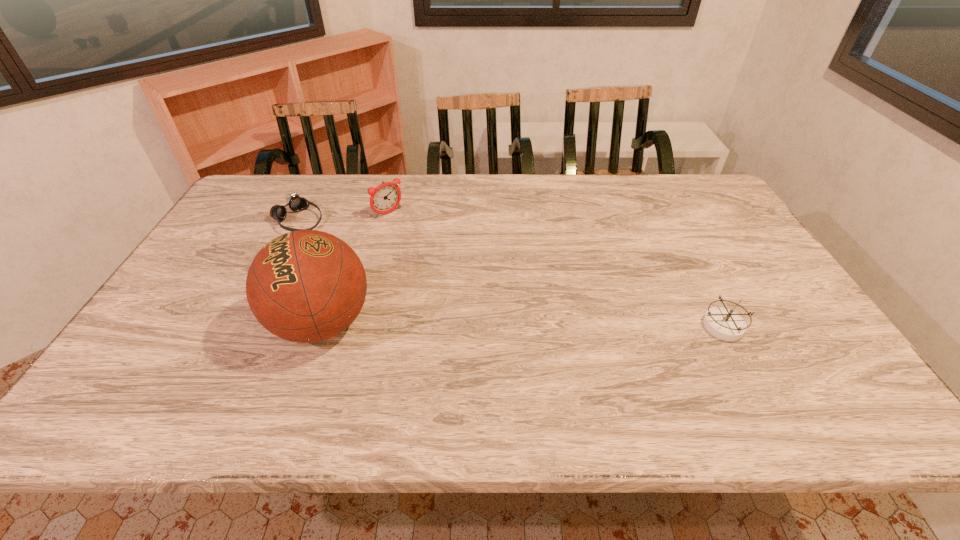
You are a GUI agent. You are given a task and a screenshot of the screen. Output one action in this format:
    pyautogui.click(x=<x>, y=<y>)
    Task: Click on the free location at the right edge
    
    Given the screenshot: What is the action you would take?
    pyautogui.click(x=699, y=246)

Image resolution: width=960 pixels, height=540 pixels. In order to click on vacant space at the far left corner of the desktop in this screenshot , I will do `click(254, 181)`.

Locate an element on the screen. The height and width of the screenshot is (540, 960). unoccupied area between the rightmost object and the alarm clock is located at coordinates (556, 269).

You are a GUI agent. You are given a task and a screenshot of the screen. Output one action in this format:
    pyautogui.click(x=<x>, y=<y>)
    Task: Click on the free space between the alarm clock and the goggles
    The image size is (960, 540).
    Given the screenshot: What is the action you would take?
    pyautogui.click(x=344, y=217)

Where is `free space between the goggles and the compass`? The height and width of the screenshot is (540, 960). free space between the goggles and the compass is located at coordinates (511, 273).

Locate an element on the screen. Image resolution: width=960 pixels, height=540 pixels. unoccupied area between the basketball and the rightmost object is located at coordinates (522, 325).

Where is `blank region between the goggles and the second tallest object`? This screenshot has width=960, height=540. blank region between the goggles and the second tallest object is located at coordinates (344, 217).

This screenshot has height=540, width=960. Find the location of `free point between the goggles and the third shortest object`. free point between the goggles and the third shortest object is located at coordinates (344, 217).

Locate an element on the screen. Image resolution: width=960 pixels, height=540 pixels. object identified as the second closest to the goggles is located at coordinates (305, 286).

Identify which object is the nearest to the second tallest object. Please provide its 2D coordinates. Your answer should be formatted as a tuple, i.e. [(x, y)], where the tuple contains the x and y coordinates of a point satisfying the conditions above.

[(296, 203)]